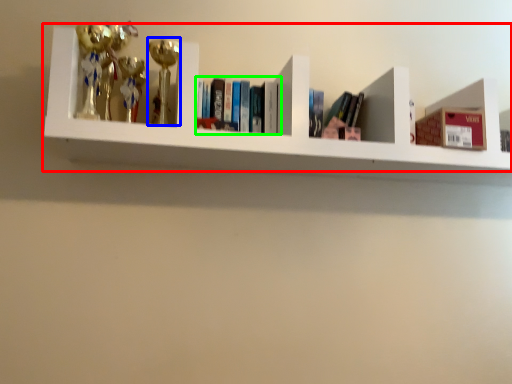
Question: Based on their relative distances, which object is farther from shelf (highlighted by a red box)? Choose from toy (highlighted by a blue box) and book (highlighted by a green box).

Choices:
 (A) toy
 (B) book

Answer: (A)